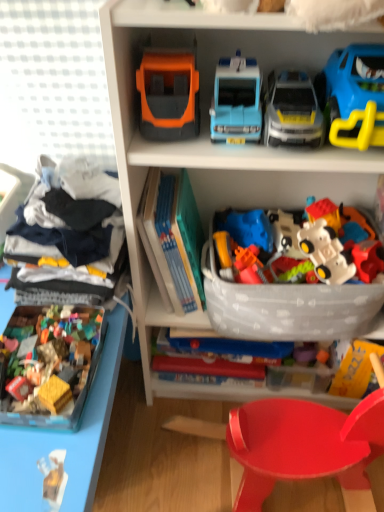
Question: Does multicolored plastic building blocks at lower left, arranged as the 1th toy when viewed from the left, appear on the right side of light blue plastic toy car at upper center, acting as the 3th toy starting from the left?

Choices:
 (A) yes
 (B) no

Answer: (B)

Question: Is multicolored plastic building blocks at lower left, the sixth toy in the right-to-left sequence, facing towards light blue plastic toy car at upper center, acting as the 3th toy starting from the left?

Choices:
 (A) yes
 (B) no

Answer: (B)

Question: Is the position of multicolored plastic building blocks at lower left, the sixth toy in the right-to-left sequence, less distant than that of light blue plastic toy car at upper center, which ranks as the 4th toy in right-to-left order?

Choices:
 (A) yes
 (B) no

Answer: (A)

Question: From the image's perspective, would you say multicolored plastic building blocks at lower left, arranged as the 1th toy when viewed from the left, is shown under light blue plastic toy car at upper center, acting as the 3th toy starting from the left?

Choices:
 (A) yes
 (B) no

Answer: (A)

Question: Considering the relative sizes of multicolored plastic building blocks at lower left, the sixth toy in the right-to-left sequence, and light blue plastic toy car at upper center, acting as the 3th toy starting from the left, in the image provided, is multicolored plastic building blocks at lower left, the sixth toy in the right-to-left sequence, wider than light blue plastic toy car at upper center, acting as the 3th toy starting from the left,?

Choices:
 (A) no
 (B) yes

Answer: (B)

Question: Is multicolored plastic building blocks at lower left, the sixth toy in the right-to-left sequence, taller or shorter than hardcover book at center?

Choices:
 (A) short
 (B) tall

Answer: (A)

Question: Would you say multicolored plastic building blocks at lower left, arranged as the 1th toy when viewed from the left, is to the left or to the right of hardcover book at center in the picture?

Choices:
 (A) left
 (B) right

Answer: (A)

Question: Is multicolored plastic building blocks at lower left, arranged as the 1th toy when viewed from the left, wider or thinner than hardcover book at center?

Choices:
 (A) thin
 (B) wide

Answer: (B)

Question: Is multicolored plastic building blocks at lower left, arranged as the 1th toy when viewed from the left, in front of or behind hardcover book at center in the image?

Choices:
 (A) front
 (B) behind

Answer: (A)

Question: Is shiny plastic chair at lower center bigger or smaller than blue plastic car at upper right, the first toy when ordered from right to left?

Choices:
 (A) small
 (B) big

Answer: (B)

Question: Considering their positions, is shiny plastic chair at lower center located in front of or behind blue plastic car at upper right, the first toy when ordered from right to left?

Choices:
 (A) front
 (B) behind

Answer: (B)

Question: Based on their positions, is shiny plastic chair at lower center located to the left or right of blue plastic car at upper right, the first toy when ordered from right to left?

Choices:
 (A) left
 (B) right

Answer: (A)

Question: Considering the positions of point (309, 453) and point (382, 62), is point (309, 453) closer or farther from the camera than point (382, 62)?

Choices:
 (A) farther
 (B) closer

Answer: (A)

Question: In terms of height, does light blue plastic toy car at upper center, which ranks as the 4th toy in right-to-left order, look taller or shorter compared to orange matte truck at upper center, placed as the second toy when sorted from left to right?

Choices:
 (A) short
 (B) tall

Answer: (A)

Question: Is light blue plastic toy car at upper center, acting as the 3th toy starting from the left, wider or thinner than orange matte truck at upper center, the 5th toy in the right-to-left sequence?

Choices:
 (A) thin
 (B) wide

Answer: (A)